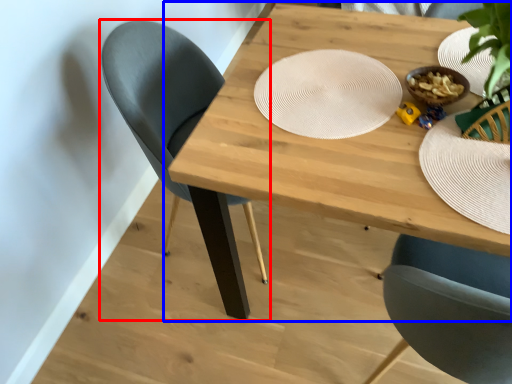
Question: Which object appears closest to the camera in this image, chair (highlighted by a red box) or table (highlighted by a blue box)?

Choices:
 (A) chair
 (B) table

Answer: (B)